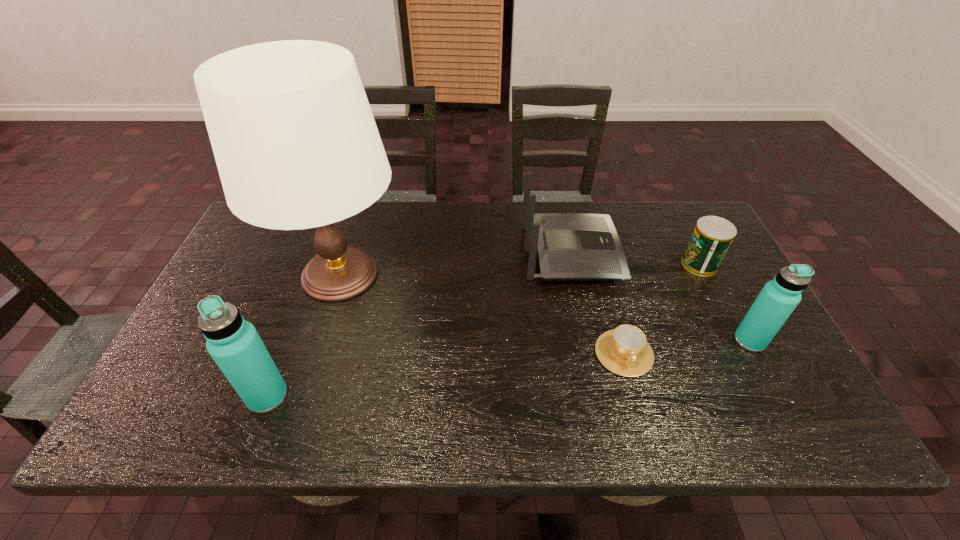
To ensure equal spacing by inserting another water_bottle among them, please point out a vacant spot for this new water_bottle. Please provide its 2D coordinates. Your answer should be formatted as a tuple, i.e. [(x, y)], where the tuple contains the x and y coordinates of a point satisfying the conditions above.

[(521, 367)]